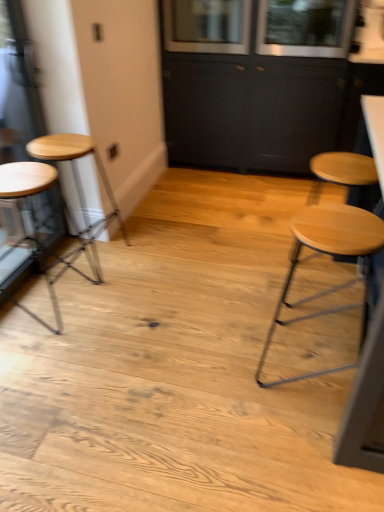
Identify the location of free location above light brown wood stool at left, placed as the second stool when sorted from right to left (from a real-world perspective). This screenshot has width=384, height=512. (62, 141).